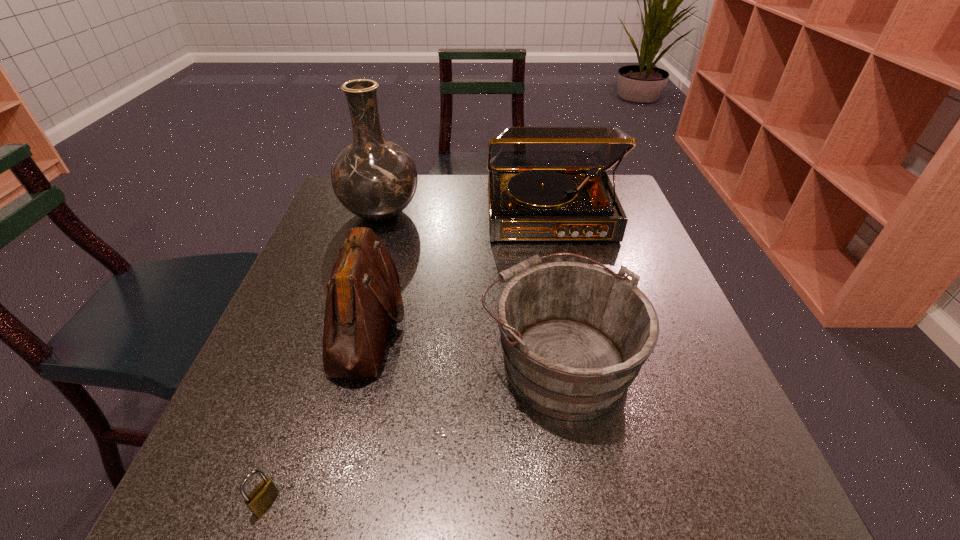
This screenshot has width=960, height=540. In order to click on object present at the near left corner in this screenshot , I will do `click(264, 494)`.

The width and height of the screenshot is (960, 540). Identify the location of object that is at the far right corner. (545, 183).

At what (x,y) coordinates should I click in order to perform the action: click on vacant area at the far edge. Please return your answer as a coordinate pair (x, y). This screenshot has width=960, height=540. Looking at the image, I should click on (449, 217).

Find the location of a particular element. The height and width of the screenshot is (540, 960). vacant space at the near edge of the desktop is located at coordinates (636, 466).

This screenshot has width=960, height=540. In order to click on free space at the left edge in this screenshot , I will do point(324,284).

Locate an element on the screen. vacant space at the right edge of the desktop is located at coordinates (657, 261).

Find the location of a particular element. The height and width of the screenshot is (540, 960). free space at the far left corner is located at coordinates (359, 219).

Identify the location of free space between the nearest object and the third shortest object. (317, 414).

This screenshot has width=960, height=540. What are the coordinates of `unoccupied area between the wine bucket and the tallest object` in the screenshot? It's located at (469, 287).

Where is `vacant space in between the tallest object and the wine bucket`? Image resolution: width=960 pixels, height=540 pixels. vacant space in between the tallest object and the wine bucket is located at coordinates coord(469,287).